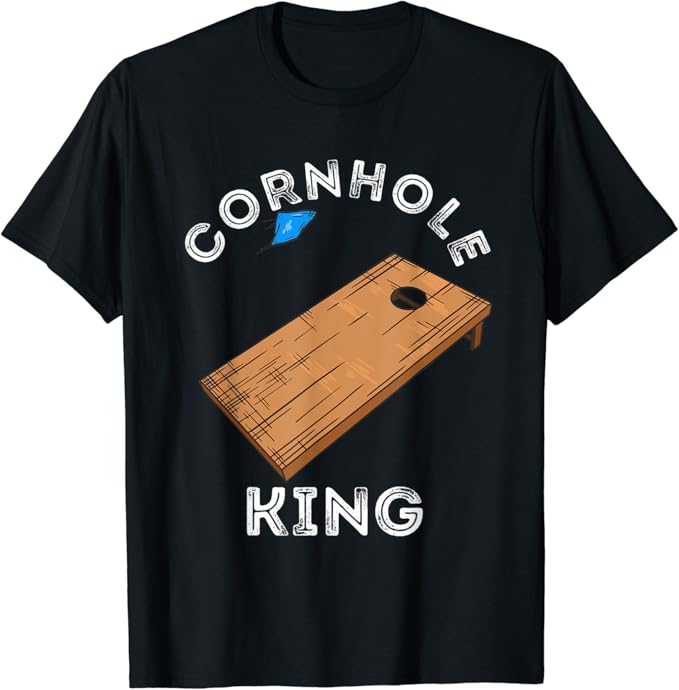
Image resolution: width=679 pixels, height=690 pixels. In order to click on table leg in this screenshot , I will do `click(474, 341)`.